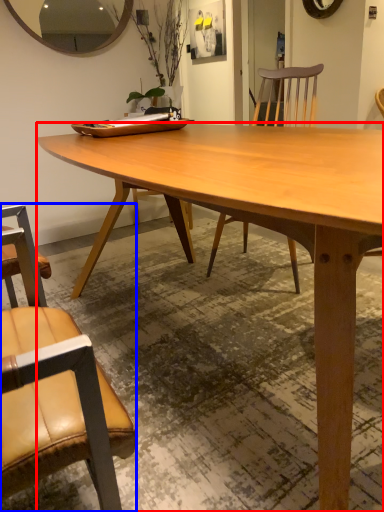
Question: Which object is closer to the camera taking this photo, desk (highlighted by a red box) or chair (highlighted by a blue box)?

Choices:
 (A) desk
 (B) chair

Answer: (B)